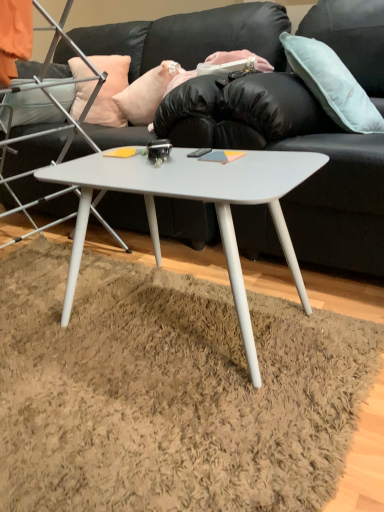
Question: Does light blue fabric pillow at upper right, the first pillow when ordered from right to left, contain black leather couch at center?

Choices:
 (A) yes
 (B) no

Answer: (B)

Question: From the image's perspective, would you say light blue fabric pillow at upper right, the first pillow when ordered from right to left, is shown under black leather couch at center?

Choices:
 (A) yes
 (B) no

Answer: (A)

Question: Does light blue fabric pillow at upper right, which is counted as the 3th pillow, starting from the left, have a larger size compared to black leather couch at center?

Choices:
 (A) no
 (B) yes

Answer: (A)

Question: Is the position of light blue fabric pillow at upper right, which is counted as the 3th pillow, starting from the left, more distant than that of black leather couch at center?

Choices:
 (A) yes
 (B) no

Answer: (B)

Question: Is light blue fabric pillow at upper right, the first pillow when ordered from right to left, to the right of black leather couch at center from the viewer's perspective?

Choices:
 (A) no
 (B) yes

Answer: (B)

Question: In the image, is white matte chair at center on the left side or the right side of peach fabric pillow at upper left, the 1th pillow in the left-to-right sequence?

Choices:
 (A) left
 (B) right

Answer: (A)

Question: Which is correct: white matte chair at center is inside peach fabric pillow at upper left, the 1th pillow in the left-to-right sequence, or outside of it?

Choices:
 (A) inside
 (B) outside

Answer: (B)

Question: In the image, is white matte chair at center positioned in front of or behind peach fabric pillow at upper left, arranged as the third pillow when viewed from the right?

Choices:
 (A) behind
 (B) front

Answer: (B)

Question: In terms of width, does white matte chair at center look wider or thinner when compared to peach fabric pillow at upper left, arranged as the third pillow when viewed from the right?

Choices:
 (A) thin
 (B) wide

Answer: (B)

Question: From the image's perspective, is pink fabric pillow at upper center, the second pillow when ordered from right to left, above or below white matte coffee table at center?

Choices:
 (A) above
 (B) below

Answer: (A)

Question: Would you say pink fabric pillow at upper center, acting as the 2th pillow starting from the left, is to the left or to the right of white matte coffee table at center in the picture?

Choices:
 (A) right
 (B) left

Answer: (B)

Question: From a real-world perspective, is pink fabric pillow at upper center, the second pillow when ordered from right to left, physically located above or below white matte coffee table at center?

Choices:
 (A) below
 (B) above

Answer: (B)

Question: Is point (157, 80) closer or farther from the camera than point (89, 182)?

Choices:
 (A) closer
 (B) farther

Answer: (B)

Question: Considering the positions of white matte coffee table at center and peach fabric pillow at upper left, arranged as the third pillow when viewed from the right, in the image, is white matte coffee table at center bigger or smaller than peach fabric pillow at upper left, arranged as the third pillow when viewed from the right,?

Choices:
 (A) small
 (B) big

Answer: (B)

Question: From a real-world perspective, relative to peach fabric pillow at upper left, arranged as the third pillow when viewed from the right, is white matte coffee table at center vertically above or below?

Choices:
 (A) above
 (B) below

Answer: (B)